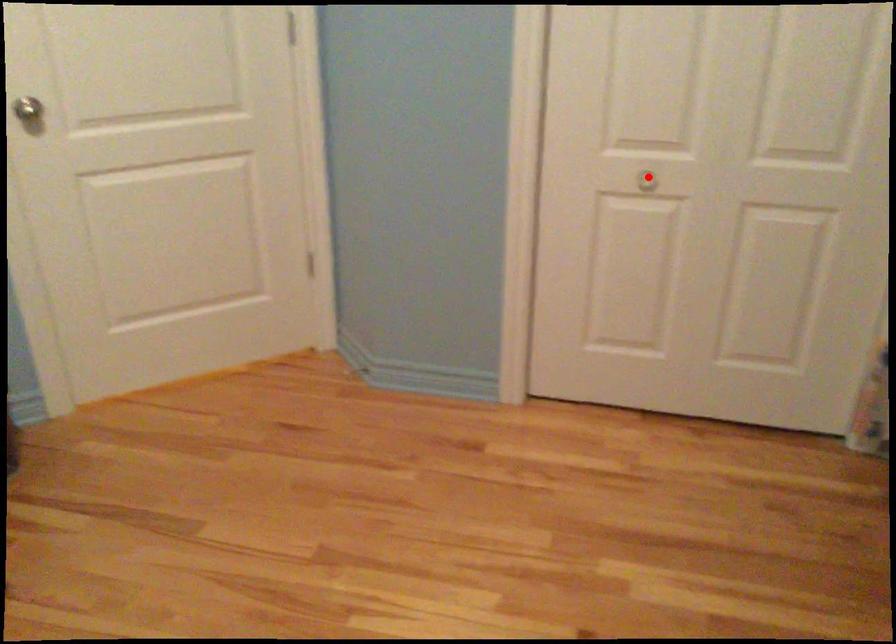
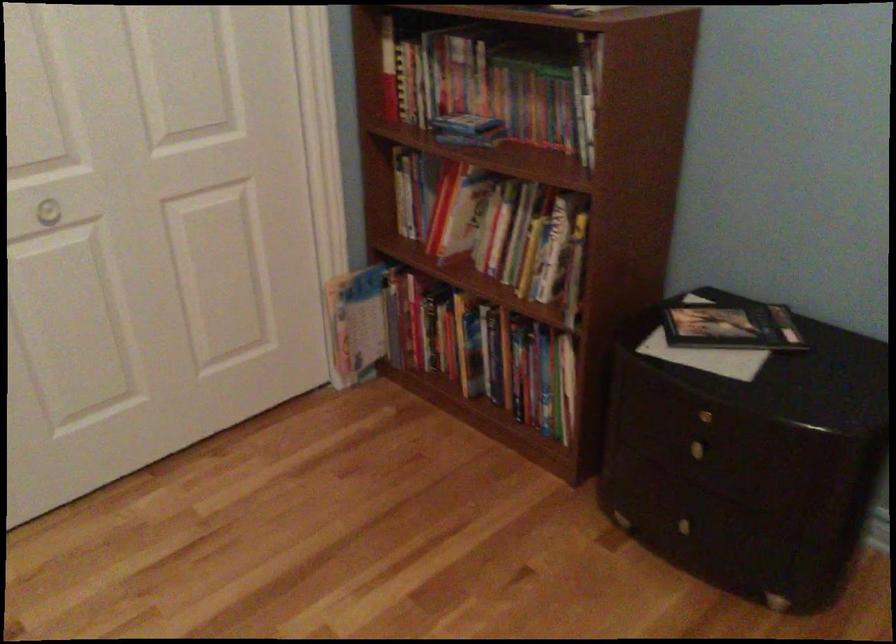
Where in the second image is the point corresponding to the highlighted location from the first image?

(47, 212)